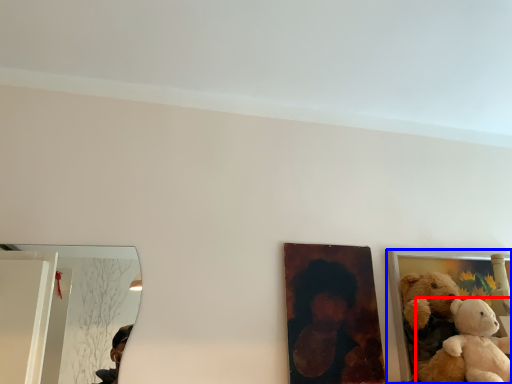
Question: Which point is closer to the camera, teddy bear (highlighted by a red box) or picture frame (highlighted by a blue box)?

Choices:
 (A) teddy bear
 (B) picture frame

Answer: (A)